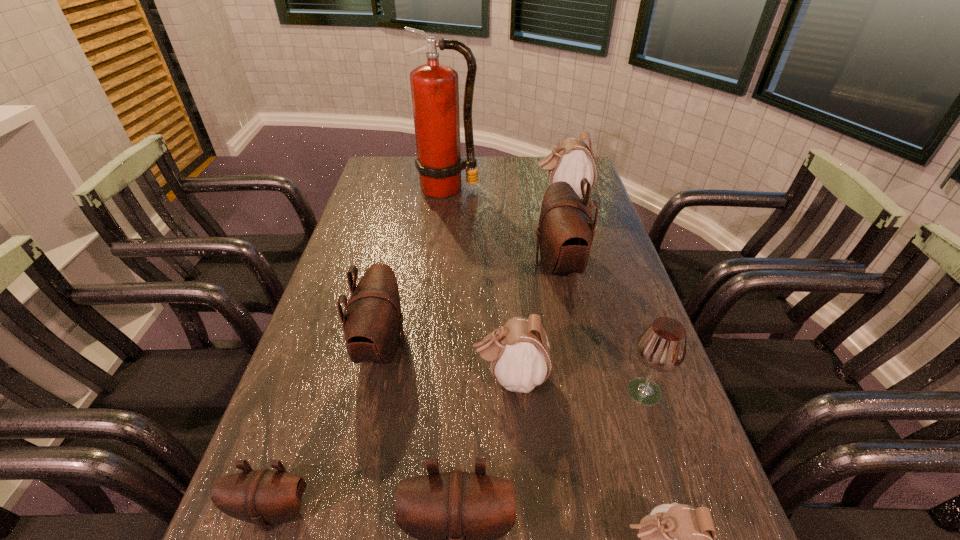
This screenshot has width=960, height=540. Identify the location of free space at the far left corner of the desktop. (400, 181).

This screenshot has height=540, width=960. Find the location of `vacant space that's between the second smallest white pouch and the third smallest brown pouch`. vacant space that's between the second smallest white pouch and the third smallest brown pouch is located at coordinates (446, 362).

Where is `vacant space that's between the second nearest white pouch and the farthest pouch`? The width and height of the screenshot is (960, 540). vacant space that's between the second nearest white pouch and the farthest pouch is located at coordinates (536, 287).

Identify which object is the sixth closest to the biggest brown pouch. Please provide its 2D coordinates. Your answer should be formatted as a tuple, i.e. [(x, y)], where the tuple contains the x and y coordinates of a point satisfying the conditions above.

[(456, 516)]

Identify which object is the third nearest to the nearest white pouch. Please provide its 2D coordinates. Your answer should be formatted as a tuple, i.e. [(x, y)], where the tuple contains the x and y coordinates of a point satisfying the conditions above.

[(519, 352)]

You are a GUI agent. You are given a task and a screenshot of the screen. Output one action in this format:
    pyautogui.click(x=<x>, y=<y>)
    Task: Click on the pouch that can be found as the second closest to the fire extinguisher
    This screenshot has height=540, width=960.
    Given the screenshot: What is the action you would take?
    pyautogui.click(x=566, y=229)

Image resolution: width=960 pixels, height=540 pixels. I want to click on pouch that is the third nearest to the red fire extinguisher, so click(372, 320).

Identify which brown pouch is the second closest to the third brown pouch from left to right. Please provide its 2D coordinates. Your answer should be formatted as a tuple, i.e. [(x, y)], where the tuple contains the x and y coordinates of a point satisfying the conditions above.

[(372, 320)]

Identify the location of brown pouch that is the third closest to the third biggest brown pouch. This screenshot has height=540, width=960. (566, 229).

Select which white pouch is the closest to the wineglass. Please provide its 2D coordinates. Your answer should be formatted as a tuple, i.e. [(x, y)], where the tuple contains the x and y coordinates of a point satisfying the conditions above.

[(519, 352)]